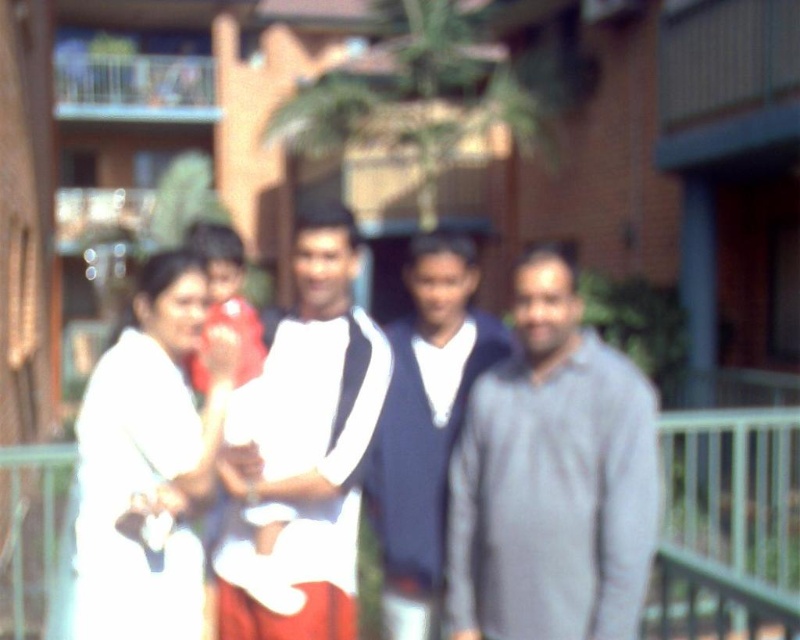
Question: Can you confirm if white fabric shirt at center is positioned to the right of white matte shirt at center?

Choices:
 (A) yes
 (B) no

Answer: (A)

Question: Which point is farther to the camera?

Choices:
 (A) gray matte shirt at center
 (B) dark blue sweater at center
 (C) white matte shirt at center
 (D) white fabric shirt at center

Answer: (B)

Question: Which of the following is the closest to the observer?

Choices:
 (A) white matte shirt at center
 (B) white matte clothing at center
 (C) dark blue sweater at center
 (D) white fabric shirt at center

Answer: (B)

Question: Is white matte clothing at center further to the viewer compared to metallic silver balustrade at lower center?

Choices:
 (A) no
 (B) yes

Answer: (A)

Question: Is white matte shirt at left further to the viewer compared to metallic silver balustrade at lower center?

Choices:
 (A) no
 (B) yes

Answer: (A)

Question: Which object appears closest to the camera in this image?

Choices:
 (A) white matte shirt at center
 (B) white matte clothing at center
 (C) white matte shirt at left
 (D) white fabric shirt at center

Answer: (B)